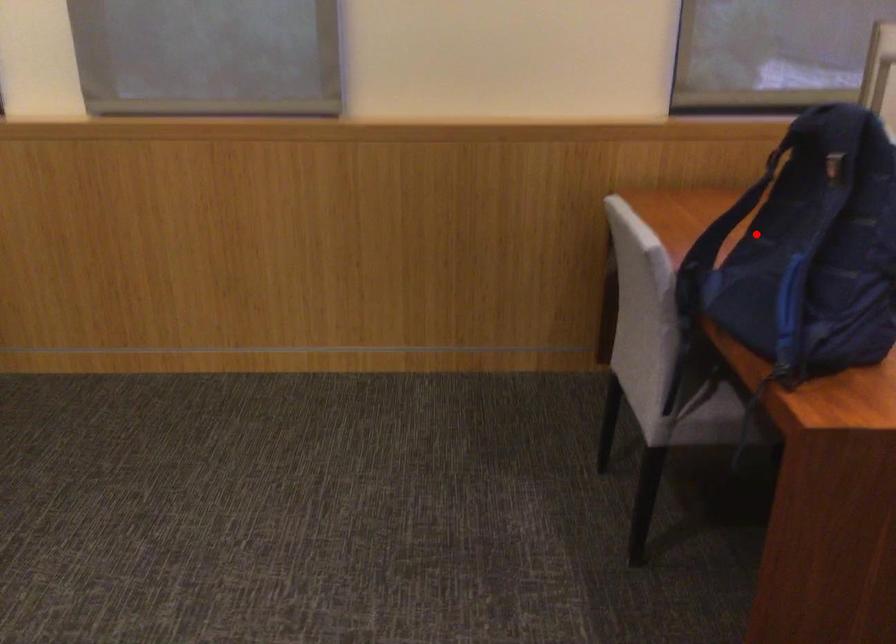
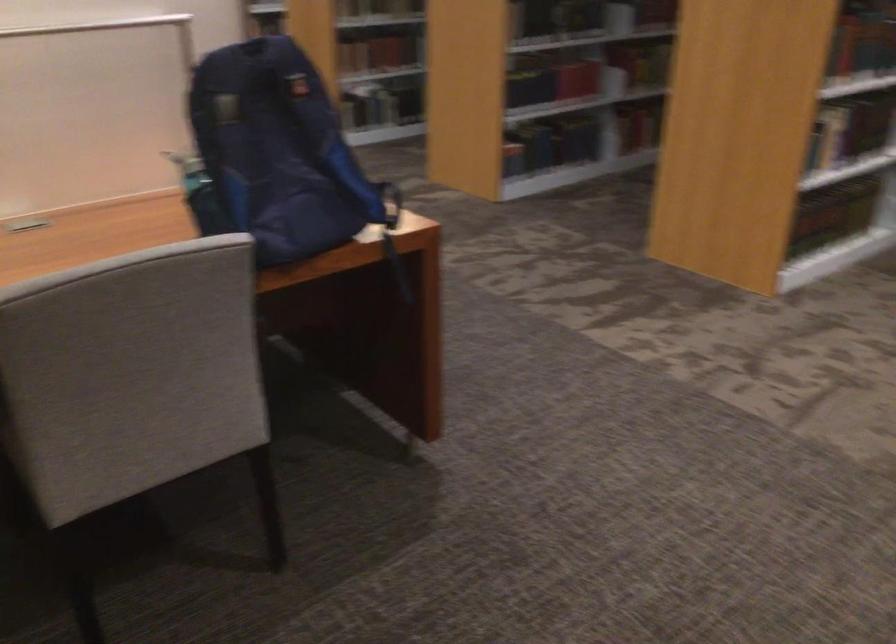
Find the pixel in the second image that matches the highlighted location in the first image.

(200, 194)